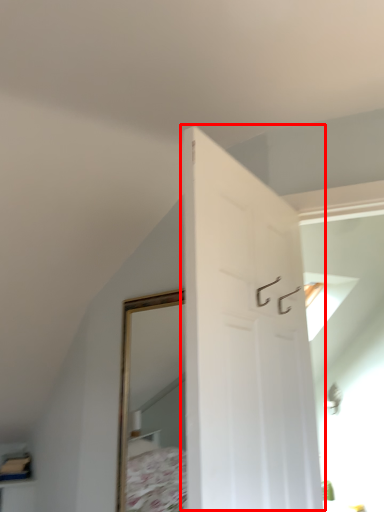
Question: Where is door (annotated by the red box) located in relation to shelf in the image?

Choices:
 (A) left
 (B) right

Answer: (B)